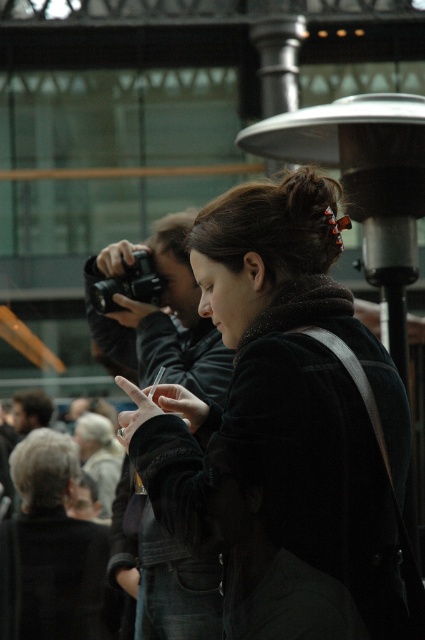
Question: Which object is farther from the camera taking this photo?

Choices:
 (A) black plastic camera at upper left
 (B) matte black camera at center
 (C) dark brown leather jacket at center

Answer: (A)

Question: Is dark brown leather jacket at center positioned at the back of matte black camera at center?

Choices:
 (A) yes
 (B) no

Answer: (B)

Question: Is matte black camera at center below black plastic camera at upper left?

Choices:
 (A) yes
 (B) no

Answer: (B)

Question: Among these objects, which one is farthest from the camera?

Choices:
 (A) dark brown leather jacket at center
 (B) matte black camera at center

Answer: (B)

Question: Is dark brown leather jacket at center to the left of black plastic camera at upper left from the viewer's perspective?

Choices:
 (A) yes
 (B) no

Answer: (B)

Question: Which point is farther from the camera taking this photo?

Choices:
 (A) (153, 296)
 (B) (164, 344)
 (C) (266, 605)

Answer: (A)